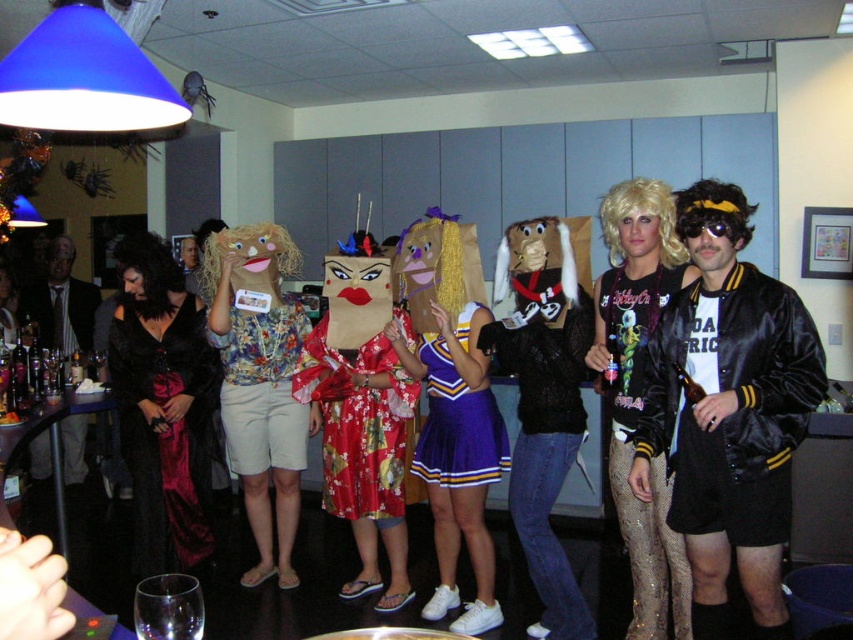
Does matte black jacket at center have a smaller size compared to floral silk kimono at center?

Incorrect, matte black jacket at center is not smaller in size than floral silk kimono at center.

Is point (575, 440) closer to viewer compared to point (386, 483)?

Yes, point (575, 440) is closer to viewer.

The width and height of the screenshot is (853, 640). I want to click on matte black jacket at center, so click(544, 435).

Is point (457, 470) farther from viewer compared to point (170, 512)?

No.

Is point (482, 556) positioned before point (132, 516)?

Yes, point (482, 556) is closer to viewer.

Locate an element on the screen. Image resolution: width=853 pixels, height=640 pixels. purple fabric cheerleader skirt at center is located at coordinates (451, 406).

Can you confirm if shiny metallic wig at center is bigger than matte black suit at left?

Yes.

Does shiny metallic wig at center come behind matte black suit at left?

That is False.

Describe the element at coordinates (639, 390) in the screenshot. This screenshot has height=640, width=853. I see `shiny metallic wig at center` at that location.

At what (x,y) coordinates should I click in order to perform the action: click on shiny metallic wig at center. Please return your answer as a coordinate pair (x, y). This screenshot has width=853, height=640. Looking at the image, I should click on (639, 390).